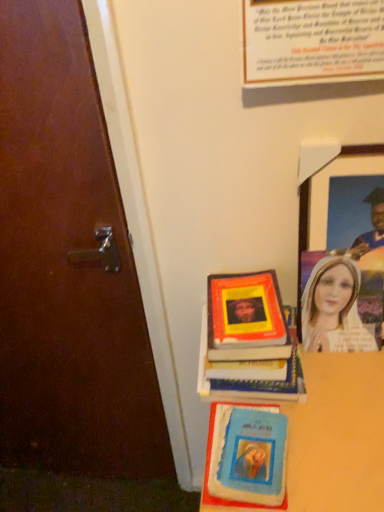
Question: Based on their positions, is smooth wooden table at lower right located to the left or right of hardcover book at center?

Choices:
 (A) right
 (B) left

Answer: (A)

Question: From a real-world perspective, relative to hardcover book at center, is smooth wooden table at lower right vertically above or below?

Choices:
 (A) below
 (B) above

Answer: (A)

Question: Which of these objects is positioned farthest from the matte plastic portrait at right?

Choices:
 (A) hardcover book at center
 (B) smooth wooden table at lower right
 (C) blue matte book at lower center
 (D) wooden picture frame at upper right
 (E) matte paper poster at upper center

Answer: (E)

Question: Estimate the real-world distances between objects in this image. Which object is closer to the blue matte book at lower center?

Choices:
 (A) hardcover book at center
 (B) matte plastic portrait at right
 (C) smooth wooden table at lower right
 (D) matte paper poster at upper center
 (E) wooden picture frame at upper right

Answer: (C)